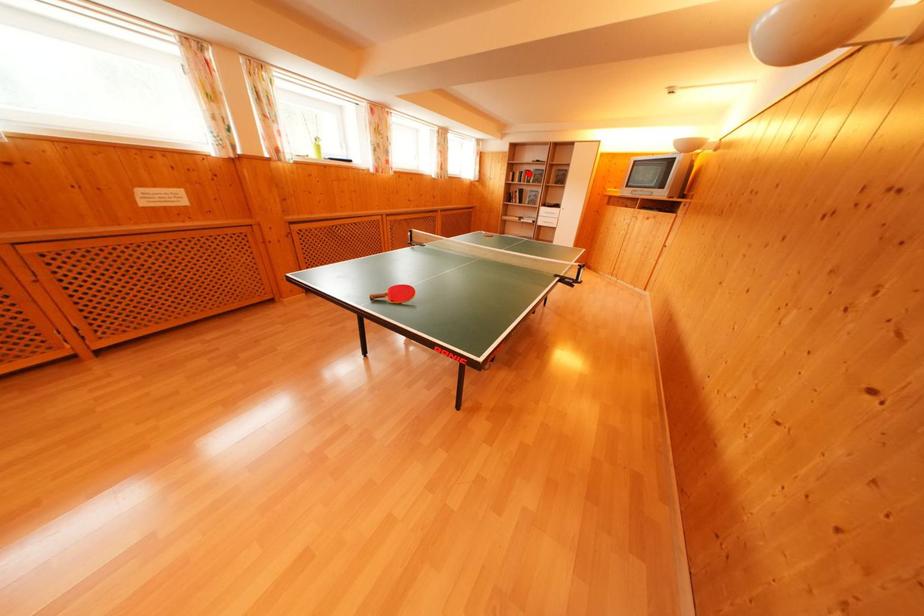
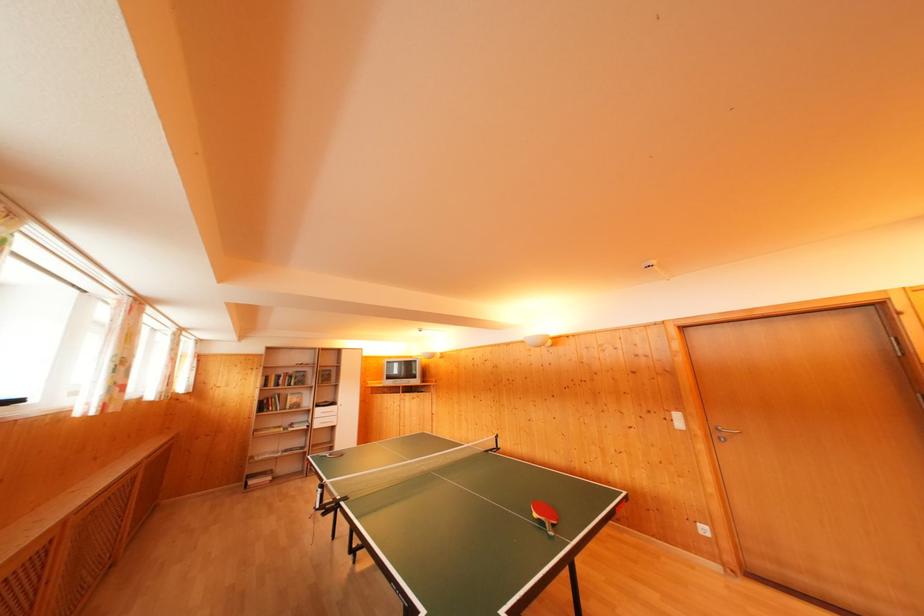
Find the pixel in the second image that matches the highlighted location in the first image.

(286, 377)